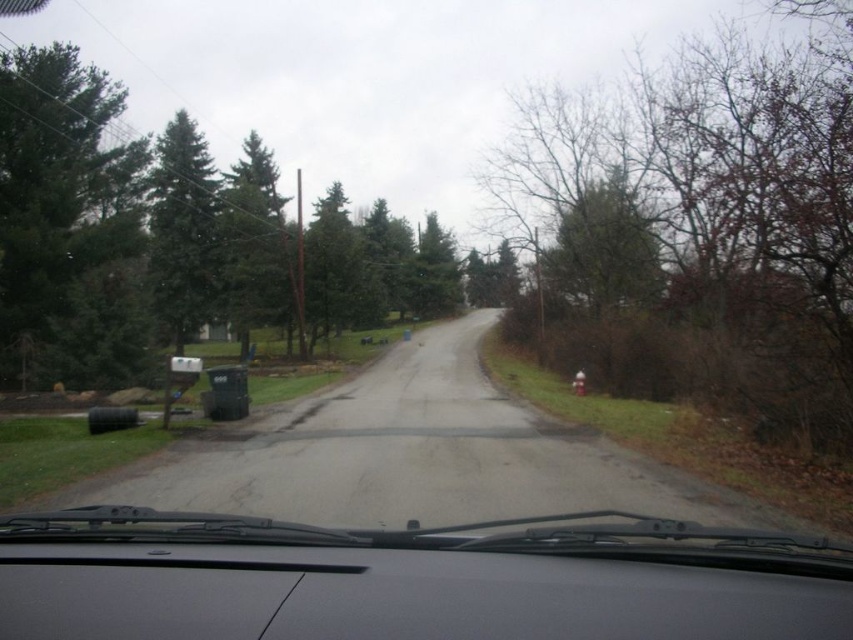
Question: Which of these objects is positioned closest to the green evergreen tree at left?

Choices:
 (A) bare branches at right
 (B) green textured tree at left
 (C) black matte windshield wipers at center
 (D) green matte tree at left

Answer: (B)

Question: Is bare branches at right positioned in front of green textured tree at left?

Choices:
 (A) no
 (B) yes

Answer: (B)

Question: Can you confirm if bare branches at right is bigger than green evergreen tree at left?

Choices:
 (A) yes
 (B) no

Answer: (B)

Question: Does green evergreen tree at left have a greater width compared to green matte tree at left?

Choices:
 (A) no
 (B) yes

Answer: (B)

Question: Which object appears farthest from the camera in this image?

Choices:
 (A) black matte windshield wipers at center
 (B) green textured tree at left

Answer: (B)

Question: Among these objects, which one is farthest from the camera?

Choices:
 (A) green textured tree at left
 (B) black matte windshield wipers at center
 (C) green evergreen tree at left
 (D) green matte tree at left

Answer: (D)